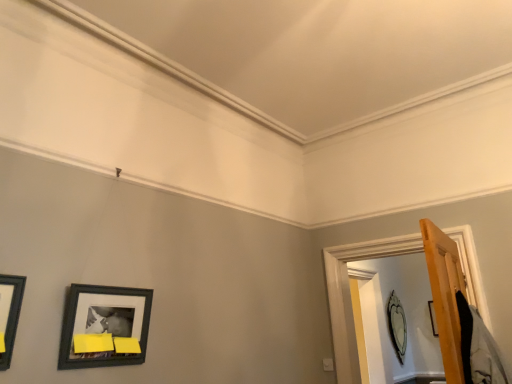
The image size is (512, 384). Describe the element at coordinates (104, 326) in the screenshot. I see `matte black picture frame at lower left, acting as the first picture frame starting from the left` at that location.

Find the location of a particular element. The width and height of the screenshot is (512, 384). wooden door frame at right is located at coordinates (350, 295).

What is the approximate height of wooden door frame at right?

wooden door frame at right is 1.01 meters tall.

Locate an element on the screen. The image size is (512, 384). matte black picture frame at lower left, acting as the first picture frame starting from the left is located at coordinates (104, 326).

Can you see matte black picture frame at lower left, which is the 2th picture frame in bottom-to-top order, touching wooden door frame at right?

No, matte black picture frame at lower left, which is the 2th picture frame in bottom-to-top order, is not beside wooden door frame at right.

Can you tell me how much matte black picture frame at lower left, placed as the 2th picture frame when sorted from back to front, and wooden door frame at right differ in facing direction?

There is a 89.3-degree angle between the facing directions of matte black picture frame at lower left, placed as the 2th picture frame when sorted from back to front, and wooden door frame at right.

Can we say matte black picture frame at lower left, acting as the first picture frame starting from the left, lies outside wooden door frame at right?

That's correct, matte black picture frame at lower left, acting as the first picture frame starting from the left, is outside of wooden door frame at right.

From a real-world perspective, relative to wooden door frame at right, is matte black picture frame at lower left, arranged as the second picture frame when viewed from the right, vertically above or below?

matte black picture frame at lower left, arranged as the second picture frame when viewed from the right, is situated lower than wooden door frame at right in the real world.

Is wooden door frame at right bigger or smaller than matte black picture frame at upper right, which is counted as the 1th picture frame, starting from the bottom?

Considering their sizes, wooden door frame at right takes up more space than matte black picture frame at upper right, which is counted as the 1th picture frame, starting from the bottom.

Where is `window frame that appears in front of the matte black picture frame at upper right, which is counted as the second picture frame, starting from the left`? The height and width of the screenshot is (384, 512). window frame that appears in front of the matte black picture frame at upper right, which is counted as the second picture frame, starting from the left is located at coordinates (350, 295).

Can you tell me how much wooden door frame at right and matte black picture frame at upper right, which is counted as the 1th picture frame, starting from the bottom, differ in facing direction?

90.5 degrees.

Who is taller, wooden door frame at right or matte black picture frame at upper right, which is counted as the second picture frame, starting from the left?

wooden door frame at right is taller.

From the image's perspective, which is above, matte black picture frame at upper right, which is counted as the 1th picture frame, starting from the bottom, or wooden door frame at right?

wooden door frame at right appears higher in the image.

Is matte black picture frame at upper right, the first picture frame viewed from the right, thinner than wooden door frame at right?

Yes, matte black picture frame at upper right, the first picture frame viewed from the right, is thinner than wooden door frame at right.

Based on the photo, does matte black picture frame at upper right, which is counted as the 1th picture frame, starting from the bottom, turn towards wooden door frame at right?

No.

Would you consider matte black picture frame at lower left, which is the 2th picture frame in bottom-to-top order, to be distant from matte black picture frame at upper right, which is counted as the 1th picture frame, starting from the bottom?

matte black picture frame at lower left, which is the 2th picture frame in bottom-to-top order, is positioned a significant distance from matte black picture frame at upper right, which is counted as the 1th picture frame, starting from the bottom.

Can you tell me how much matte black picture frame at lower left, which is the 2th picture frame in bottom-to-top order, and matte black picture frame at upper right, positioned as the 1th picture frame in back-to-front order, differ in facing direction?

They differ by 1.24 degrees in their facing directions.

Is matte black picture frame at lower left, which is the 1th picture frame from front to back, oriented towards matte black picture frame at upper right, the second picture frame positioned from the top?

No, matte black picture frame at lower left, which is the 1th picture frame from front to back, is not oriented towards matte black picture frame at upper right, the second picture frame positioned from the top.

From a real-world perspective, between matte black picture frame at lower left, which is the 1th picture frame from front to back, and matte black picture frame at upper right, the second picture frame positioned from the top, who is vertically lower?

matte black picture frame at upper right, the second picture frame positioned from the top.

Considering the sizes of objects wooden door frame at right and matte black picture frame at lower left, acting as the first picture frame starting from the left, in the image provided, who is shorter, wooden door frame at right or matte black picture frame at lower left, acting as the first picture frame starting from the left,?

With less height is matte black picture frame at lower left, acting as the first picture frame starting from the left.

Is wooden door frame at right completely or partially outside of matte black picture frame at lower left, acting as the first picture frame starting from the left?

Yes, wooden door frame at right is located beyond the bounds of matte black picture frame at lower left, acting as the first picture frame starting from the left.

Is wooden door frame at right facing away from matte black picture frame at lower left, which is the first picture frame in top-to-bottom order?

No.

From the image's perspective, between wooden door frame at right and matte black picture frame at lower left, which is the first picture frame in top-to-bottom order, which one is located above?

matte black picture frame at lower left, which is the first picture frame in top-to-bottom order, appears higher in the image.

Considering the relative sizes of matte black picture frame at upper right, which is the second picture frame in front-to-back order, and matte black picture frame at lower left, which is the first picture frame in top-to-bottom order, in the image provided, is matte black picture frame at upper right, which is the second picture frame in front-to-back order, taller than matte black picture frame at lower left, which is the first picture frame in top-to-bottom order,?

Yes.

Does matte black picture frame at upper right, which is counted as the 1th picture frame, starting from the bottom, have a larger size compared to matte black picture frame at lower left, arranged as the second picture frame when viewed from the right?

Yes.

Is the surface of matte black picture frame at upper right, which is the second picture frame in front-to-back order, in direct contact with matte black picture frame at lower left, arranged as the second picture frame when viewed from the right?

No, matte black picture frame at upper right, which is the second picture frame in front-to-back order, is not beside matte black picture frame at lower left, arranged as the second picture frame when viewed from the right.

From the image's perspective, is matte black picture frame at upper right, which is counted as the second picture frame, starting from the left, beneath matte black picture frame at lower left, which is the 1th picture frame from front to back?

Indeed, from the image's perspective, matte black picture frame at upper right, which is counted as the second picture frame, starting from the left, is shown beneath matte black picture frame at lower left, which is the 1th picture frame from front to back.

The image size is (512, 384). I want to click on window frame that is behind the matte black picture frame at lower left, acting as the first picture frame starting from the left, so click(350, 295).

Locate an element on the screen. This screenshot has height=384, width=512. window frame on the left side of matte black picture frame at upper right, which is counted as the second picture frame, starting from the left is located at coordinates (350, 295).

From the image, which object appears to be nearer to matte black picture frame at lower left, acting as the first picture frame starting from the left, wooden door frame at right or matte black picture frame at upper right, which is the second picture frame in front-to-back order?

wooden door frame at right lies closer to matte black picture frame at lower left, acting as the first picture frame starting from the left, than the other object.

From the image, which object appears to be nearer to wooden door frame at right, matte black picture frame at lower left, acting as the first picture frame starting from the left, or matte black picture frame at upper right, which is the second picture frame in front-to-back order?

matte black picture frame at upper right, which is the second picture frame in front-to-back order.

Considering their positions, is matte black picture frame at upper right, the first picture frame viewed from the right, positioned further to matte black picture frame at lower left, which is the first picture frame in top-to-bottom order, than wooden door frame at right?

The object further to matte black picture frame at lower left, which is the first picture frame in top-to-bottom order, is matte black picture frame at upper right, the first picture frame viewed from the right.

In the scene shown: Which object lies nearer to the anchor point matte black picture frame at upper right, which is counted as the second picture frame, starting from the left, wooden door frame at right or matte black picture frame at lower left, which is the 2th picture frame in bottom-to-top order?

wooden door frame at right is positioned closer to the anchor matte black picture frame at upper right, which is counted as the second picture frame, starting from the left.

From the image, which object appears to be nearer to matte black picture frame at upper right, positioned as the 1th picture frame in back-to-front order, matte black picture frame at lower left, which is the 1th picture frame from front to back, or wooden door frame at right?

wooden door frame at right.

Looking at the image, which one is located closer to wooden door frame at right, matte black picture frame at upper right, positioned as the 1th picture frame in back-to-front order, or matte black picture frame at lower left, arranged as the second picture frame when viewed from the right?

matte black picture frame at upper right, positioned as the 1th picture frame in back-to-front order, is closer to wooden door frame at right.

Find the location of `window frame located between matte black picture frame at lower left, which is the first picture frame in top-to-bottom order, and matte black picture frame at upper right, the first picture frame viewed from the right, in the depth direction`. window frame located between matte black picture frame at lower left, which is the first picture frame in top-to-bottom order, and matte black picture frame at upper right, the first picture frame viewed from the right, in the depth direction is located at coordinates (350, 295).